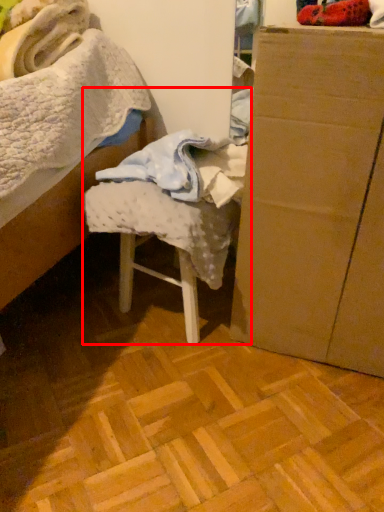
Question: Considering the relative positions of chair (annotated by the red box) and furniture in the image provided, where is chair (annotated by the red box) located with respect to the staircase?

Choices:
 (A) left
 (B) right

Answer: (A)